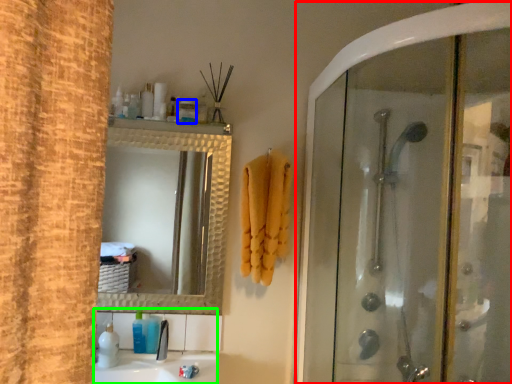
Question: Based on their relative distances, which object is farther from screen door (highlighted by a red box)? Choose from toiletry (highlighted by a blue box) and sink (highlighted by a green box).

Choices:
 (A) toiletry
 (B) sink

Answer: (A)